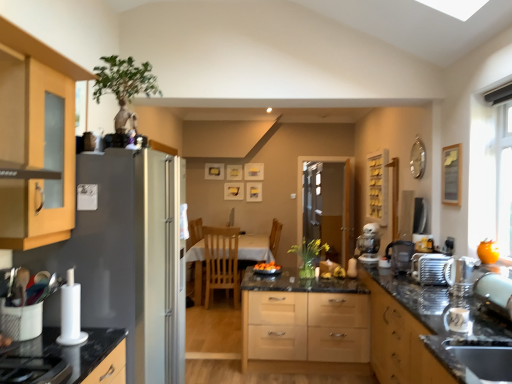
Where is `free location in front of orange matte bowl at center`? This screenshot has width=512, height=384. free location in front of orange matte bowl at center is located at coordinates (275, 278).